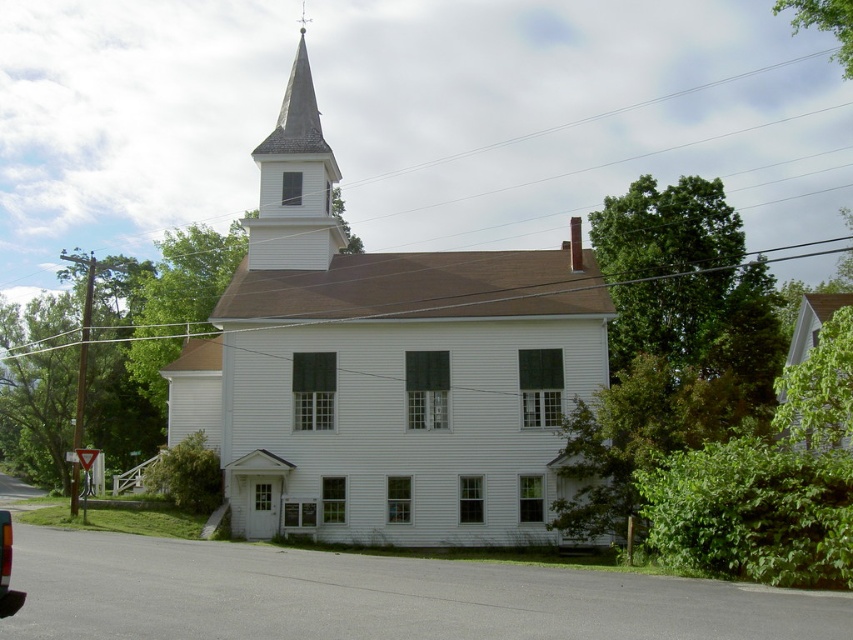
Is white wood church at center to the right of metallic red taillight at lower left from the viewer's perspective?

Indeed, white wood church at center is positioned on the right side of metallic red taillight at lower left.

Which is behind, point (368, 538) or point (4, 579)?

Point (368, 538)

Where is `white wood church at center`? white wood church at center is located at coordinates (386, 369).

Is point (282, 259) positioned after point (799, 410)?

Yes, it is behind point (799, 410).

Does point (322, 172) come in front of point (824, 326)?

No, (322, 172) is behind (824, 326).

Between point (331, 237) and point (813, 435), which one is positioned behind?

The point (331, 237) is more distant.

At what (x,y) coordinates should I click in order to perform the action: click on white wood spire at upper center. Please return your answer as a coordinate pair (x, y). This screenshot has height=640, width=853. Looking at the image, I should click on (294, 182).

Is white wood spire at upper center below metallic red taillight at lower left?

Incorrect, white wood spire at upper center is not positioned below metallic red taillight at lower left.

Does white wood spire at upper center appear over metallic red taillight at lower left?

Yes.

Where is `white wood spire at upper center`? white wood spire at upper center is located at coordinates (294, 182).

What are the coordinates of `white wood spire at upper center` in the screenshot? It's located at (294, 182).